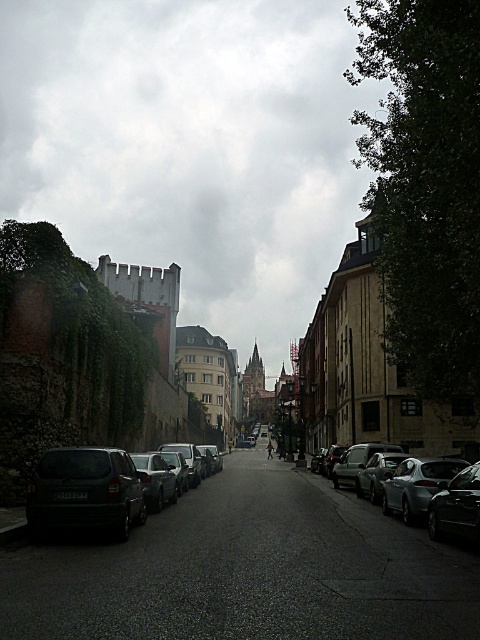
Question: Is shiny black car at lower right above shiny silver sedan at center?

Choices:
 (A) no
 (B) yes

Answer: (B)

Question: Among these points, which one is nearest to the camera?

Choices:
 (A) (372, 467)
 (B) (389, 486)
 (C) (474, 464)

Answer: (C)

Question: Can you confirm if shiny black car at lower right is smaller than shiny silver sedan at center?

Choices:
 (A) no
 (B) yes

Answer: (B)

Question: Does silver metallic sedan at right appear on the left side of shiny silver sedan at center?

Choices:
 (A) yes
 (B) no

Answer: (B)

Question: Which point is closer to the camera taking this photo?

Choices:
 (A) [404, 518]
 (B) [363, 467]

Answer: (A)

Question: Which is farther from the dark gray matte car at lower left?

Choices:
 (A) silver metallic car at center
 (B) shiny black car at lower right
 (C) shiny silver sedan at center

Answer: (C)